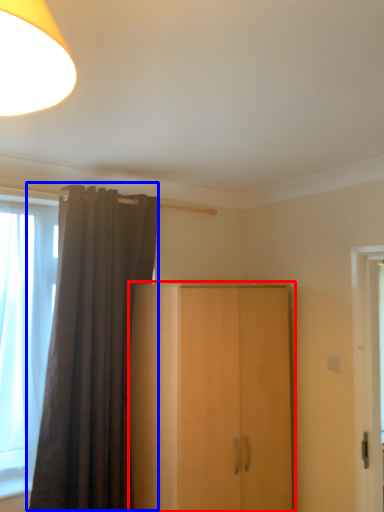
Question: Which object appears closest to the camera in this image, cupboard (highlighted by a red box) or curtain (highlighted by a blue box)?

Choices:
 (A) cupboard
 (B) curtain

Answer: (A)